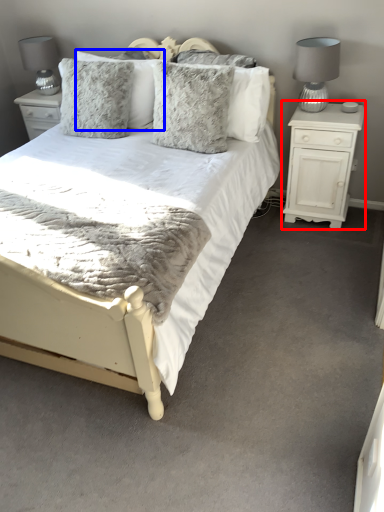
Question: Which object is closer to the camera taking this photo, nightstand (highlighted by a red box) or pillow (highlighted by a blue box)?

Choices:
 (A) nightstand
 (B) pillow

Answer: (A)